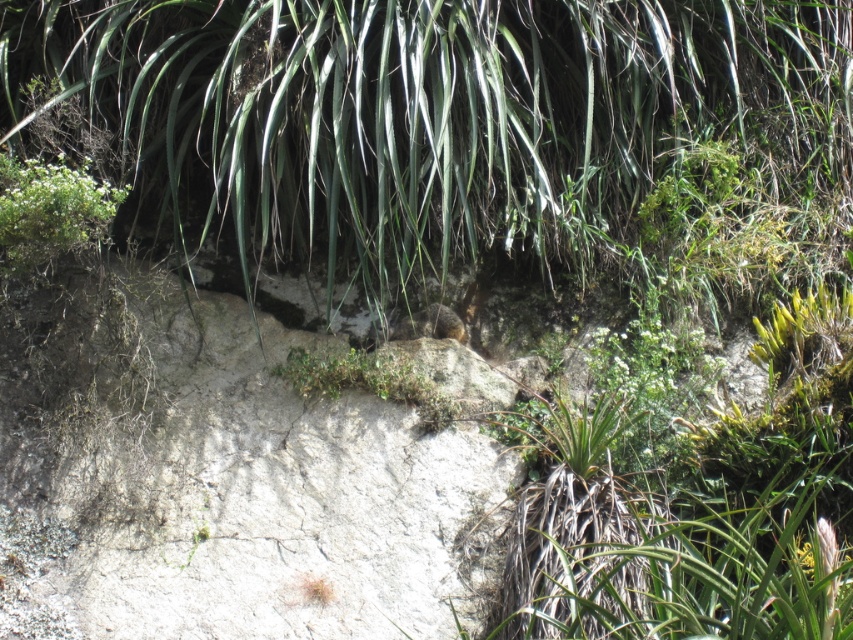
In the scene shown: You are standing in front of the rocky surface and want to place a small flag at the point closer to the camera between point (190, 84) and point (1, 211). Which point should you choose?

You should choose point (190, 84) because it is further to the camera than point (1, 211).

You are standing at the edge of the rocky surface in the scene. There is a green leafy plant at upper center marked by point (x=433, y=115). Which direction should you move to reach it?

You should move towards the upper center direction to reach the green leafy plant at upper center marked by point (x=433, y=115).